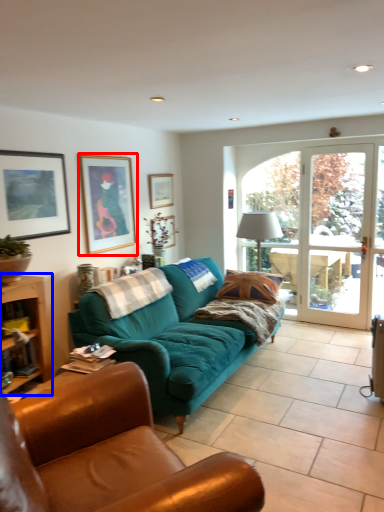
Question: Which point is further to the camera, picture frame (highlighted by a red box) or table (highlighted by a blue box)?

Choices:
 (A) picture frame
 (B) table

Answer: (A)